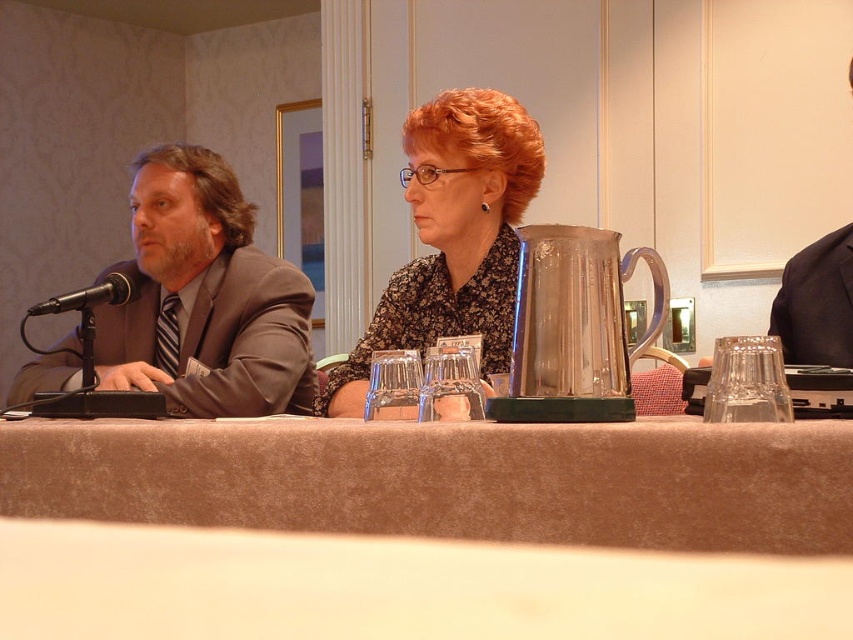
Between point (265, 276) and point (456, 186), which one is positioned in front?

Point (456, 186) is more forward.

Where is `matte gray suit at left`? matte gray suit at left is located at coordinates (204, 298).

Is point (151, 273) positioned behind point (428, 182)?

That is True.

Image resolution: width=853 pixels, height=640 pixels. I want to click on matte gray suit at left, so click(x=204, y=298).

Measure the distance between brown fabric table at center and matte gray suit at left.

brown fabric table at center is 32.88 inches from matte gray suit at left.

Which is behind, point (340, 435) or point (141, 269)?

Point (141, 269)

Identify the location of brown fabric table at center. (450, 480).

Between dark blue fabric business suit at right and black metallic microphone at left, which one has more height?

Standing taller between the two is dark blue fabric business suit at right.

Who is more distant from viewer, [798,289] or [74,301]?

The point [798,289] is behind.

Does point (833, 248) come in front of point (68, 310)?

That is True.

Find the location of a particular element. dark blue fabric business suit at right is located at coordinates (816, 301).